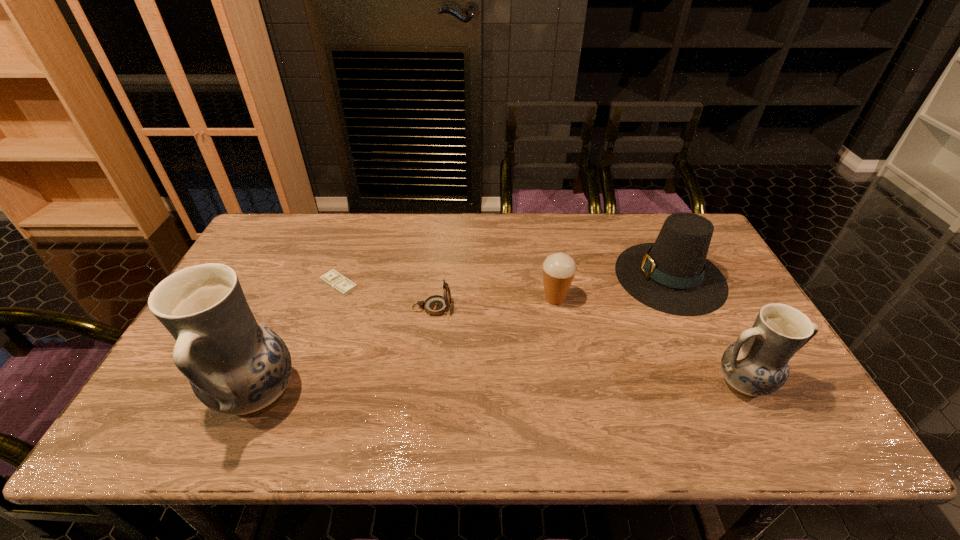
In order to click on hat that is at the right edge in this screenshot , I will do `click(672, 275)`.

Locate an element on the screen. Image resolution: width=960 pixels, height=540 pixels. object situated at the near left corner is located at coordinates (236, 366).

Where is `object at the far right corner`? The width and height of the screenshot is (960, 540). object at the far right corner is located at coordinates (672, 275).

Locate an element on the screen. The height and width of the screenshot is (540, 960). object located at the near right corner is located at coordinates (757, 364).

Image resolution: width=960 pixels, height=540 pixels. In the image, there is a desktop. What are the coordinates of `vacant space at the far edge` in the screenshot? It's located at (376, 219).

In the image, there is a desktop. Where is `free space at the near edge`? free space at the near edge is located at coordinates (450, 400).

Find the location of a particular element. Image resolution: width=960 pixels, height=540 pixels. free location at the right edge is located at coordinates [708, 332].

In the image, there is a desktop. Where is `vacant space at the far left corner`? This screenshot has height=540, width=960. vacant space at the far left corner is located at coordinates (266, 230).

Find the location of a particular element. free space at the near left corner is located at coordinates (165, 405).

The image size is (960, 540). Identify the location of free spot between the right pottery and the third object from right to left. (649, 341).